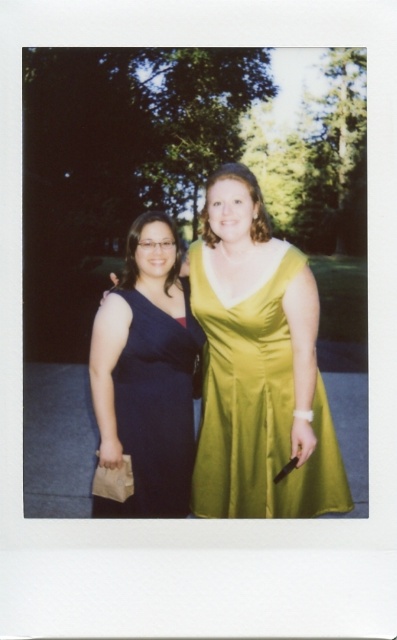
Based on the photo, you are a photographer trying to capture a closeup of the satin yellow dress at center without the matte blue dress at left appearing in the background. Is the current positioning of the subjects suitable for this?

Yes, the satin yellow dress at center is in front of the matte blue dress at left, so the photographer can focus on the satin yellow dress at center and the matte blue dress at left will not be visible in the background.

Based on the scene description, which dress is taller, the satin yellow dress at center or the matte blue dress at left?

The satin yellow dress at center is taller than the matte blue dress at left according to the description.